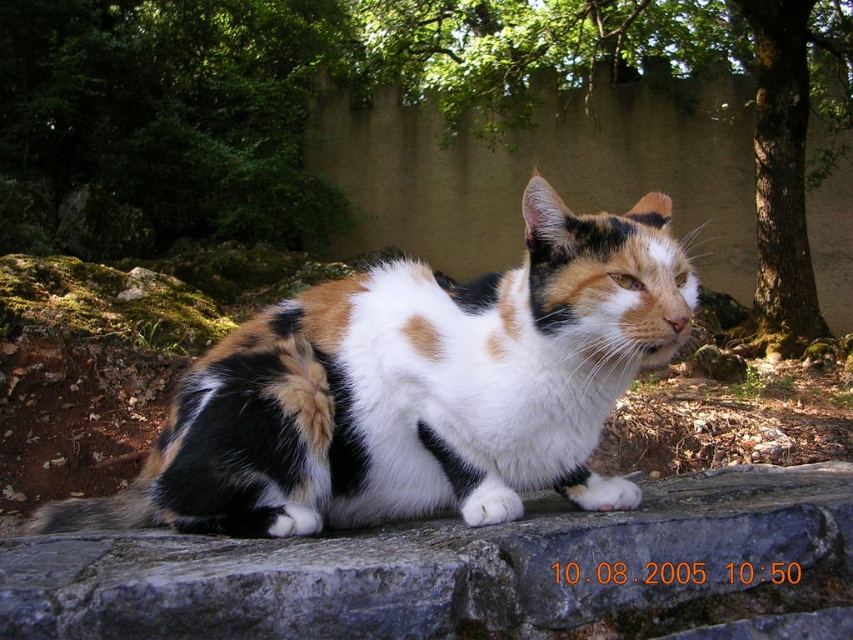
Is point (308, 29) more distant than point (590, 3)?

Yes, point (308, 29) is behind point (590, 3).

From the picture: Is green leafy tree at upper left thinner than green leafy tree at upper center?

No, green leafy tree at upper left is not thinner than green leafy tree at upper center.

Which is in front, point (141, 74) or point (529, 22)?

Point (529, 22) is more forward.

This screenshot has width=853, height=640. I want to click on green leafy tree at upper left, so click(172, 108).

Find the location of a particular element. The image size is (853, 640). calico fur cat at center is located at coordinates (416, 388).

Identify the location of calico fur cat at center. The image size is (853, 640). [x=416, y=388].

Can you confirm if calico fur cat at center is shorter than green leafy tree at upper center?

No.

Who is more distant from viewer, (621, 333) or (779, 68)?

The point (779, 68) is more distant.

Image resolution: width=853 pixels, height=640 pixels. What are the coordinates of `calico fur cat at center` in the screenshot? It's located at (416, 388).